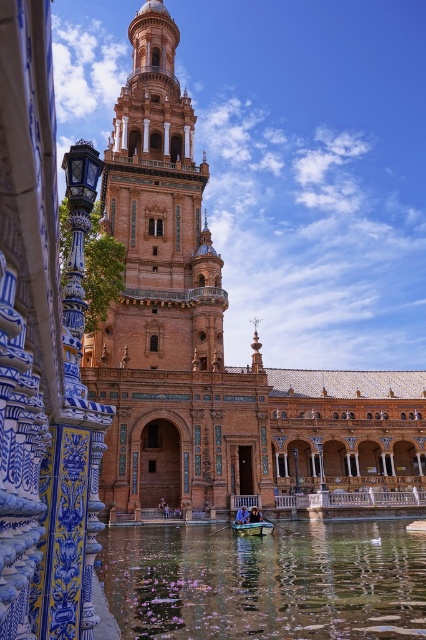
Question: Estimate the real-world distances between objects in this image. Which object is farther from the brown textured stone palace at center?

Choices:
 (A) clear water at center
 (B) wooden boat at lower center

Answer: (B)

Question: Which of the following is the farthest from the observer?

Choices:
 (A) wooden boat at lower center
 (B) clear water at center

Answer: (A)

Question: Which point is farther to the camera?

Choices:
 (A) terracotta brick bell tower at center
 (B) brown textured stone palace at center
 (C) clear water at center
 (D) wooden boat at lower center

Answer: (A)

Question: Is brown textured stone palace at center below clear water at center?

Choices:
 (A) yes
 (B) no

Answer: (B)

Question: Is brown textured stone palace at center positioned at the back of terracotta brick bell tower at center?

Choices:
 (A) yes
 (B) no

Answer: (B)

Question: Is brown textured stone palace at center bigger than wooden boat at lower center?

Choices:
 (A) no
 (B) yes

Answer: (B)